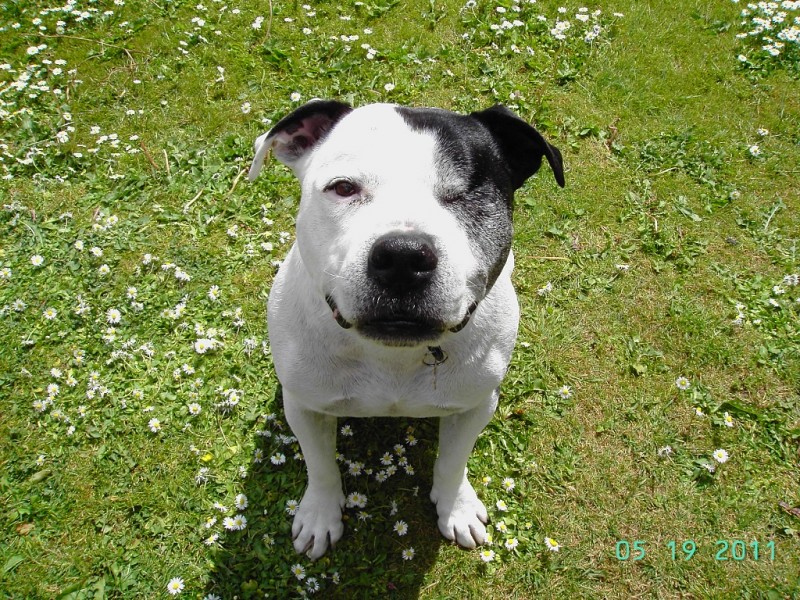
Locate an element on the screen. The width and height of the screenshot is (800, 600). far right corner white flowers is located at coordinates (x=761, y=19).